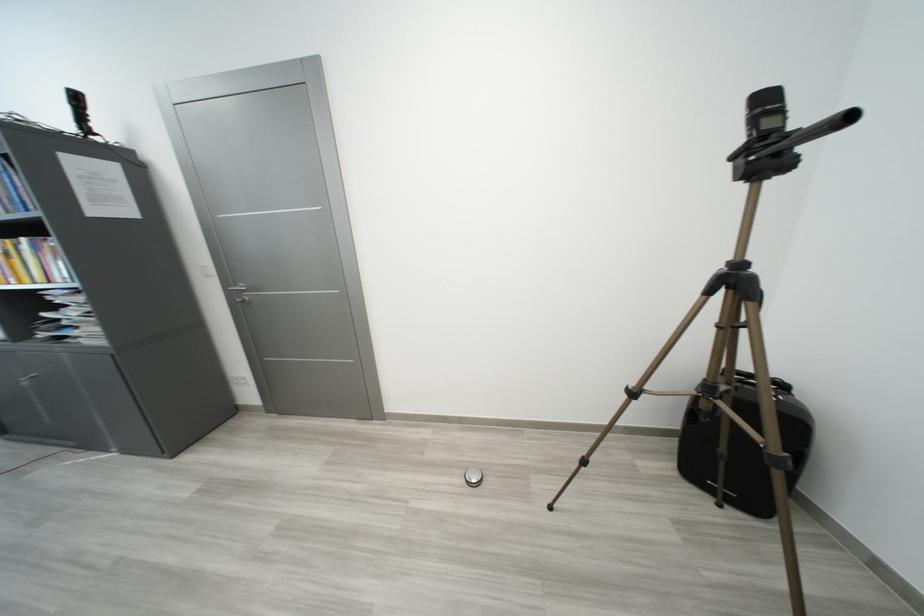
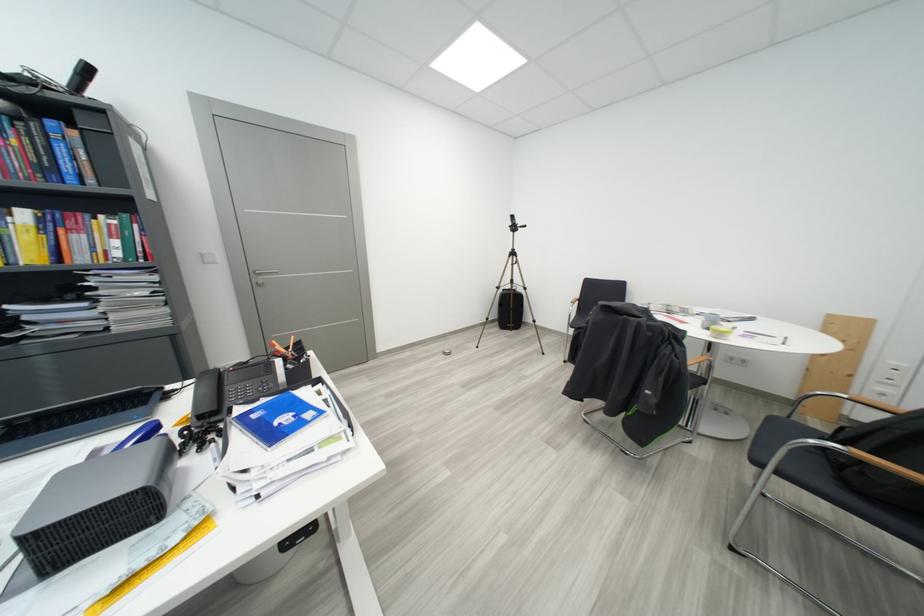
Find the pixel in the second image that matches (x=641, y=397) in the first image.

(506, 291)